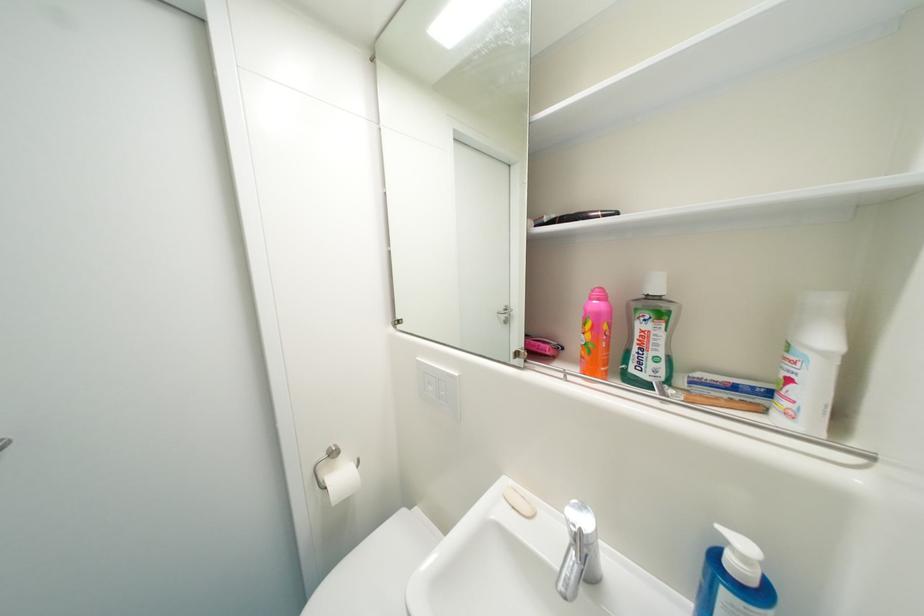
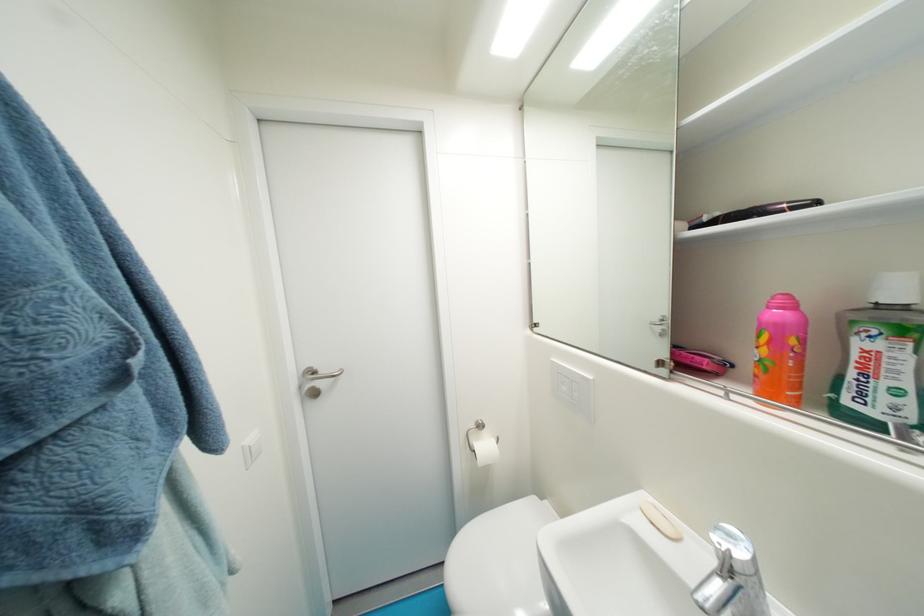
Find the pixel in the second image that matches point 438,390 in the first image.

(570, 390)